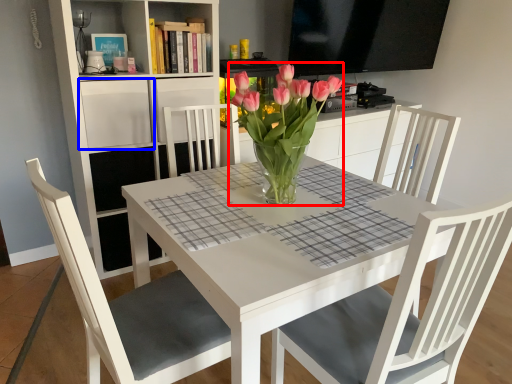
Question: Which point is further to the camera, floral arrangement (highlighted by a red box) or shelf (highlighted by a blue box)?

Choices:
 (A) floral arrangement
 (B) shelf

Answer: (B)